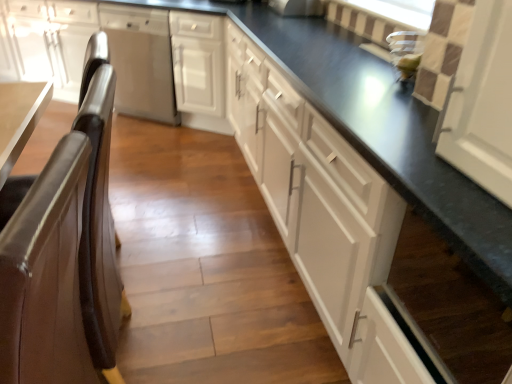
Locate an element on the screen. The height and width of the screenshot is (384, 512). free space behind brown leather chair at left is located at coordinates coord(166,281).